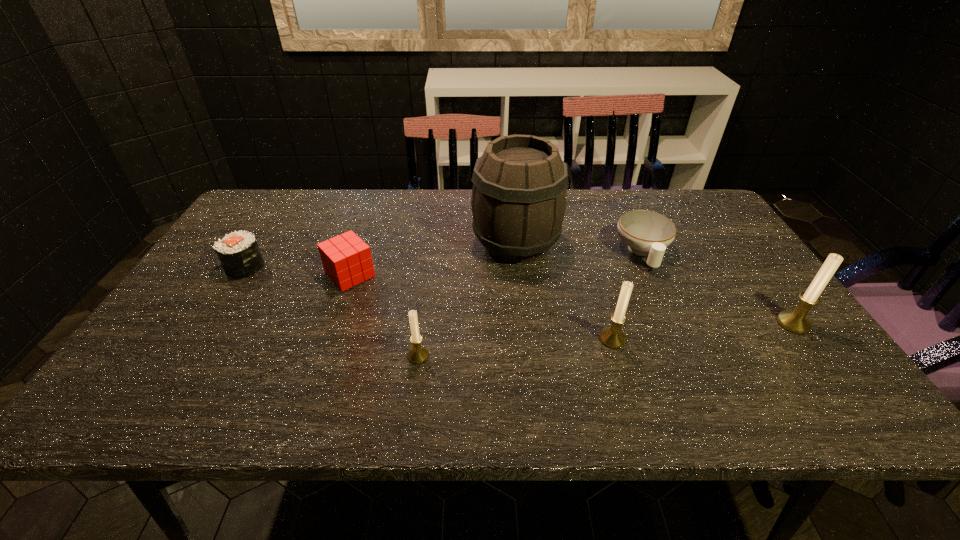
Where is `cube`? The width and height of the screenshot is (960, 540). cube is located at coordinates (346, 259).

The height and width of the screenshot is (540, 960). I want to click on blank area located 0.290m on the back of the leftmost candle holder, so click(x=430, y=266).

You are a GUI agent. You are given a task and a screenshot of the screen. Output one action in this format:
    pyautogui.click(x=<x>, y=<y>)
    Task: Click on the vacant space situated 0.360m on the left of the second candle holder from right to left
    This screenshot has width=960, height=540.
    Given the screenshot: What is the action you would take?
    pyautogui.click(x=444, y=339)

This screenshot has width=960, height=540. In order to click on vacant space located 0.400m on the left of the sixth shortest object in this screenshot , I will do `click(611, 323)`.

The image size is (960, 540). What are the coordinates of `free space located 0.400m on the left of the tallest object` in the screenshot? It's located at (335, 244).

Locate an element on the screen. This screenshot has height=540, width=960. blank area located 0.310m on the side with the handle of the chinaware is located at coordinates (695, 369).

What are the coordinates of `vacant space located on the front of the sushi` in the screenshot? It's located at (209, 323).

Locate an element on the screen. free spot located on the front of the cube is located at coordinates (328, 340).

Where is `object that is at the far edge`? The width and height of the screenshot is (960, 540). object that is at the far edge is located at coordinates (518, 202).

The height and width of the screenshot is (540, 960). I want to click on object positioned at the left edge, so click(x=238, y=252).